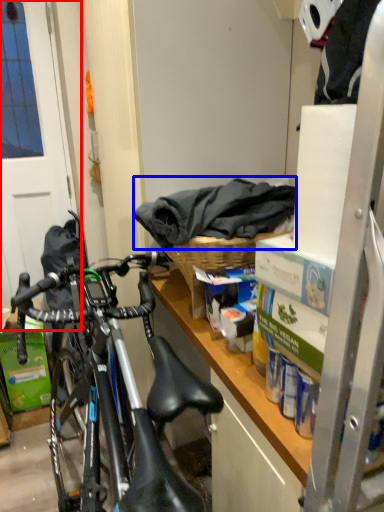
Question: Which point is further to the camera, screen door (highlighted by a red box) or material (highlighted by a blue box)?

Choices:
 (A) screen door
 (B) material

Answer: (A)